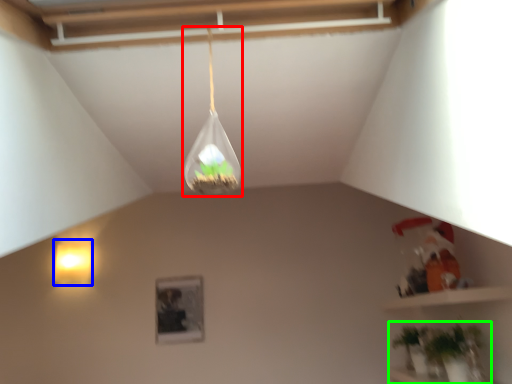
Question: Which object is positioned closest to lamp (highlighted by a red box)? Select from lamp (highlighted by a blue box) and houseplant (highlighted by a green box).

Choices:
 (A) lamp
 (B) houseplant

Answer: (B)